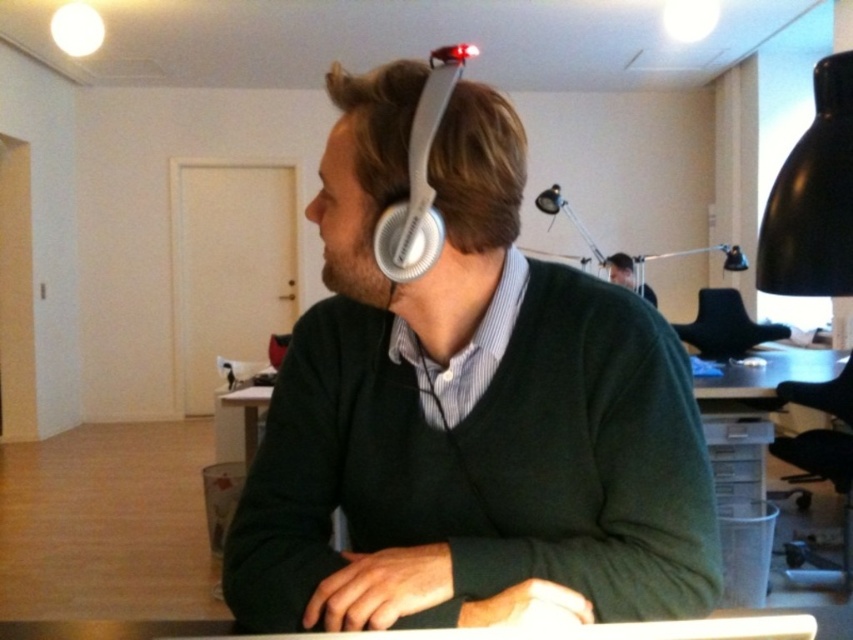
In the office scene, there is a black leather chair at center and a matte green sweater at upper center. Which object is positioned to the right of the other?

The black leather chair at center is to the right of the matte green sweater at upper center.

You are standing in the office and want to move from the point at coordinates point [729,336] to the point at coordinates point [625,266]. Since you can only move forward, will you be able to reach the second point without turning around?

Point [729,336] is in front of point [625,266]. Since you are facing forward, you would need to move backward to reach the second point, so you cannot reach it without turning around.

You are an office worker who needs to reach both the matte white headphones at center and the matte green sweater at upper center. Which object is closer to you?

The matte white headphones at center is closer to the viewer than the matte green sweater at upper center.